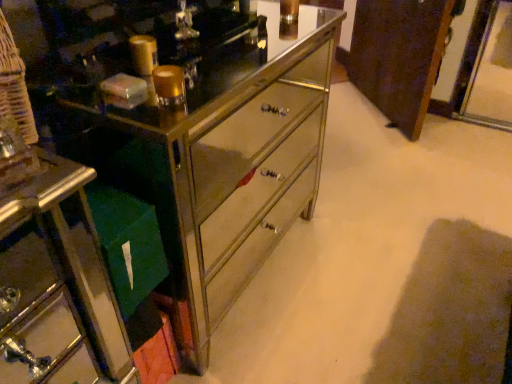
Describe the element at coordinates (58, 284) in the screenshot. I see `green fabric bag at lower left` at that location.

What do you see at coordinates (188, 126) in the screenshot? The width and height of the screenshot is (512, 384). I see `metallic mirrored chest of drawers at center` at bounding box center [188, 126].

What are the coordinates of `brown wood cabinet at center` in the screenshot? It's located at (399, 56).

Does point (396, 98) come closer to viewer compared to point (321, 96)?

No, (396, 98) is behind (321, 96).

Measure the distance between brown wood cabinet at center and metallic mirrored chest of drawers at center.

brown wood cabinet at center is 3.93 feet from metallic mirrored chest of drawers at center.

Locate an element on the screen. The height and width of the screenshot is (384, 512). cabinetry located above the metallic mirrored chest of drawers at center (from the image's perspective) is located at coordinates (399, 56).

Considering the relative sizes of brown wood cabinet at center and metallic mirrored chest of drawers at center in the image provided, is brown wood cabinet at center smaller than metallic mirrored chest of drawers at center?

Indeed, brown wood cabinet at center has a smaller size compared to metallic mirrored chest of drawers at center.

Considering the positions of objects metallic mirrored chest of drawers at center and green fabric bag at lower left in the image provided, who is more to the left, metallic mirrored chest of drawers at center or green fabric bag at lower left?

From the viewer's perspective, green fabric bag at lower left appears more on the left side.

Considering the positions of objects metallic mirrored chest of drawers at center and green fabric bag at lower left in the image provided, who is behind, metallic mirrored chest of drawers at center or green fabric bag at lower left?

green fabric bag at lower left.

What are the coordinates of `chest of drawers above the green fabric bag at lower left (from the image's perspective)` in the screenshot? It's located at (188, 126).

From a real-world perspective, between metallic mirrored chest of drawers at center and green fabric bag at lower left, who is vertically higher?

In real-world perspective, metallic mirrored chest of drawers at center is above.

Does green fabric bag at lower left have a greater width compared to metallic mirrored chest of drawers at center?

Incorrect, the width of green fabric bag at lower left does not surpass that of metallic mirrored chest of drawers at center.

From a real-world perspective, is green fabric bag at lower left beneath metallic mirrored chest of drawers at center?

Yes, from a real-world perspective, green fabric bag at lower left is below metallic mirrored chest of drawers at center.

I want to click on furniture on the left of metallic mirrored chest of drawers at center, so pos(58,284).

Is brown wood cabinet at center taller or shorter than green fabric bag at lower left?

Clearly, brown wood cabinet at center is taller compared to green fabric bag at lower left.

Would you say brown wood cabinet at center is inside or outside green fabric bag at lower left?

brown wood cabinet at center exists outside the volume of green fabric bag at lower left.

Is brown wood cabinet at center smaller than green fabric bag at lower left?

Actually, brown wood cabinet at center might be larger than green fabric bag at lower left.

Which point is more forward, (410, 67) or (6, 260)?

The point (6, 260) is more forward.

Can you confirm if metallic mirrored chest of drawers at center is taller than brown wood cabinet at center?

Indeed, metallic mirrored chest of drawers at center has a greater height compared to brown wood cabinet at center.

From the image's perspective, is metallic mirrored chest of drawers at center located above or below brown wood cabinet at center?

Based on their image positions, metallic mirrored chest of drawers at center is located beneath brown wood cabinet at center.

Which of these two, metallic mirrored chest of drawers at center or brown wood cabinet at center, is bigger?

metallic mirrored chest of drawers at center.

How many degrees apart are the facing directions of green fabric bag at lower left and brown wood cabinet at center?

The angle between the facing direction of green fabric bag at lower left and the facing direction of brown wood cabinet at center is 137 degrees.

From the image's perspective, is green fabric bag at lower left positioned above or below brown wood cabinet at center?

green fabric bag at lower left is below brown wood cabinet at center.

In terms of width, does green fabric bag at lower left look wider or thinner when compared to brown wood cabinet at center?

→ In the image, green fabric bag at lower left appears to be more narrow than brown wood cabinet at center.

Where is `cabinetry above the metallic mirrored chest of drawers at center (from the image's perspective)`? The width and height of the screenshot is (512, 384). cabinetry above the metallic mirrored chest of drawers at center (from the image's perspective) is located at coordinates (399, 56).

Locate an element on the screen. Image resolution: width=512 pixels, height=384 pixels. furniture that is below the metallic mirrored chest of drawers at center (from the image's perspective) is located at coordinates (58, 284).

Considering their positions, is green fabric bag at lower left positioned closer to metallic mirrored chest of drawers at center than brown wood cabinet at center?

green fabric bag at lower left is positioned closer to the anchor metallic mirrored chest of drawers at center.

Which object lies nearer to the anchor point green fabric bag at lower left, brown wood cabinet at center or metallic mirrored chest of drawers at center?

Based on the image, metallic mirrored chest of drawers at center appears to be nearer to green fabric bag at lower left.

From the image, which object appears to be farther from brown wood cabinet at center, metallic mirrored chest of drawers at center or green fabric bag at lower left?

Among the two, green fabric bag at lower left is located further to brown wood cabinet at center.

Based on their spatial positions, is green fabric bag at lower left or metallic mirrored chest of drawers at center closer to brown wood cabinet at center?

metallic mirrored chest of drawers at center is closer to brown wood cabinet at center.

Considering their positions, is metallic mirrored chest of drawers at center positioned closer to green fabric bag at lower left than brown wood cabinet at center?

metallic mirrored chest of drawers at center lies closer to green fabric bag at lower left than the other object.

Consider the image. From the image, which object appears to be nearer to metallic mirrored chest of drawers at center, brown wood cabinet at center or green fabric bag at lower left?

green fabric bag at lower left is positioned closer to the anchor metallic mirrored chest of drawers at center.

Identify the location of the chest of drawers situated between green fabric bag at lower left and brown wood cabinet at center from left to right. (188, 126).